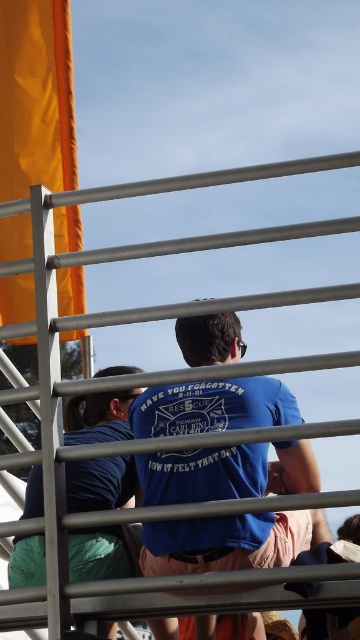
Can you confirm if blue cotton t-shirt at center is positioned below matte blue t-shirt at center?

Correct, blue cotton t-shirt at center is located below matte blue t-shirt at center.

Can you confirm if blue cotton t-shirt at center is smaller than matte blue t-shirt at center?

No, blue cotton t-shirt at center is not smaller than matte blue t-shirt at center.

Between point (206, 561) and point (105, 470), which one is positioned behind?

The point (105, 470) is more distant.

Find the location of a particular element. Image resolution: width=360 pixels, height=640 pixels. blue cotton t-shirt at center is located at coordinates (227, 472).